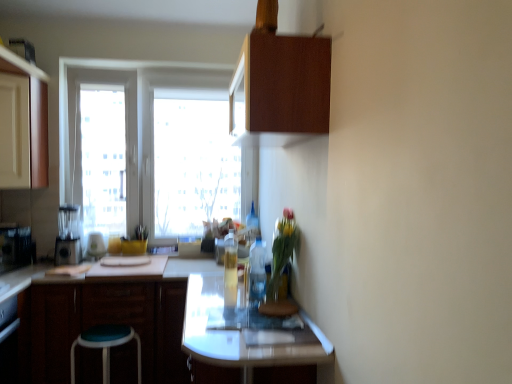
Where is `teal fabric stool at lower left`? teal fabric stool at lower left is located at coordinates (106, 346).

Where is `matte black blender at left, which is counted as the 2th appliance, starting from the right`? matte black blender at left, which is counted as the 2th appliance, starting from the right is located at coordinates (68, 236).

Image resolution: width=512 pixels, height=384 pixels. I want to click on translucent glass bottle at center, arranged as the 2th bottle when viewed from the front, so click(x=230, y=275).

What do you see at coordinates (281, 253) in the screenshot?
I see `translucent glass vase at center` at bounding box center [281, 253].

Where is `teal fabric stool at lower left`? This screenshot has height=384, width=512. teal fabric stool at lower left is located at coordinates (106, 346).

From the image's perspective, who appears lower, wooden cabinet at upper center, which is the third cabinetry from bottom to top, or teal fabric stool at lower left?

teal fabric stool at lower left.

Can we say wooden cabinet at upper center, placed as the first cabinetry when sorted from right to left, lies outside teal fabric stool at lower left?

Indeed, wooden cabinet at upper center, placed as the first cabinetry when sorted from right to left, is completely outside teal fabric stool at lower left.

From the picture: How many degrees apart are the facing directions of wooden cabinet at upper center, the third cabinetry in the left-to-right sequence, and teal fabric stool at lower left?

The facing directions of wooden cabinet at upper center, the third cabinetry in the left-to-right sequence, and teal fabric stool at lower left are 90 degrees apart.

Does point (316, 68) lie behind point (100, 344)?

No, it is in front of (100, 344).

Based on the photo, does translucent glass bottle at upper center, arranged as the 1th bottle when viewed from the back, touch teal fabric stool at lower left?

translucent glass bottle at upper center, arranged as the 1th bottle when viewed from the back, and teal fabric stool at lower left are not in contact.

Is point (249, 234) positioned after point (100, 333)?

Yes, point (249, 234) is farther from viewer.

Which object is further away from the camera, translucent glass bottle at upper center, acting as the third bottle starting from the front, or teal fabric stool at lower left?

translucent glass bottle at upper center, acting as the third bottle starting from the front, is further from the camera.

Considering the sizes of objects translucent glass bottle at upper center, acting as the third bottle starting from the front, and teal fabric stool at lower left in the image provided, who is thinner, translucent glass bottle at upper center, acting as the third bottle starting from the front, or teal fabric stool at lower left?

With smaller width is translucent glass bottle at upper center, acting as the third bottle starting from the front.

From a real-world perspective, does matte wood cabinet at left, positioned as the 3th cabinetry in right-to-left order, sit lower than metallic silver toaster at left, positioned as the 1th appliance in left-to-right order?

Actually, matte wood cabinet at left, positioned as the 3th cabinetry in right-to-left order, is physically above metallic silver toaster at left, positioned as the 1th appliance in left-to-right order, in the real world.

Considering the sizes of objects matte wood cabinet at left, the second cabinetry positioned from the bottom, and metallic silver toaster at left, positioned as the 1th appliance in left-to-right order, in the image provided, who is shorter, matte wood cabinet at left, the second cabinetry positioned from the bottom, or metallic silver toaster at left, positioned as the 1th appliance in left-to-right order,?

metallic silver toaster at left, positioned as the 1th appliance in left-to-right order, is shorter.

Considering the relative sizes of matte wood cabinet at left, positioned as the 3th cabinetry in right-to-left order, and metallic silver toaster at left, which appears as the 3th appliance when viewed from the right, in the image provided, is matte wood cabinet at left, positioned as the 3th cabinetry in right-to-left order, wider than metallic silver toaster at left, which appears as the 3th appliance when viewed from the right,?

Yes.

Measure the distance between matte wood cabinet at left, positioned as the 3th cabinetry in right-to-left order, and metallic silver toaster at left, which appears as the 3th appliance when viewed from the right.

They are 27.01 inches apart.

Considering the positions of points (22, 256) and (284, 111), is point (22, 256) farther from camera compared to point (284, 111)?

Yes, point (22, 256) is behind point (284, 111).

Find the location of `appliance that is the 2nd object directly below the wooden cabinet at upper center, the 1th cabinetry when ordered from top to bottom (from a real-world perspective)`. appliance that is the 2nd object directly below the wooden cabinet at upper center, the 1th cabinetry when ordered from top to bottom (from a real-world perspective) is located at coordinates (15, 248).

From the image's perspective, which one is positioned higher, metallic silver toaster at left, positioned as the 1th appliance in left-to-right order, or wooden cabinet at upper center, placed as the first cabinetry when sorted from right to left?

wooden cabinet at upper center, placed as the first cabinetry when sorted from right to left, appears higher in the image.

Can you tell me how much metallic silver toaster at left, positioned as the 1th appliance in left-to-right order, and wooden cabinet at upper center, placed as the first cabinetry when sorted from right to left, differ in facing direction?

There is a 163-degree angle between the facing directions of metallic silver toaster at left, positioned as the 1th appliance in left-to-right order, and wooden cabinet at upper center, placed as the first cabinetry when sorted from right to left.

Is translucent glass bottle at center, acting as the 2th bottle starting from the back, thinner than wooden cabinet at upper center, placed as the first cabinetry when sorted from right to left?

Indeed, translucent glass bottle at center, acting as the 2th bottle starting from the back, has a lesser width compared to wooden cabinet at upper center, placed as the first cabinetry when sorted from right to left.

What's the angular difference between translucent glass bottle at center, acting as the 2th bottle starting from the back, and wooden cabinet at upper center, the third cabinetry in the left-to-right sequence,'s facing directions?

4.03e-05 degrees separate the facing orientations of translucent glass bottle at center, acting as the 2th bottle starting from the back, and wooden cabinet at upper center, the third cabinetry in the left-to-right sequence.

Is translucent glass bottle at center, arranged as the 2th bottle when viewed from the front, next to wooden cabinet at upper center, which is the third cabinetry from bottom to top, and touching it?

No, translucent glass bottle at center, arranged as the 2th bottle when viewed from the front, is not next to wooden cabinet at upper center, which is the third cabinetry from bottom to top.

From the image's perspective, which one is positioned higher, translucent glass bottle at center, arranged as the 2th bottle when viewed from the front, or wooden cabinet at upper center, which is the third cabinetry from bottom to top?

wooden cabinet at upper center, which is the third cabinetry from bottom to top, appears higher in the image.

Is the position of translucent glass bottle at center, the 3th bottle positioned from the back, less distant than that of matte black blender at left, which is the second appliance from left to right?

Yes, it is in front of matte black blender at left, which is the second appliance from left to right.

How different are the orientations of translucent glass bottle at center, which is the first bottle in front-to-back order, and matte black blender at left, which is the second appliance from left to right, in degrees?

translucent glass bottle at center, which is the first bottle in front-to-back order, and matte black blender at left, which is the second appliance from left to right, are facing 90 degrees away from each other.

Is translucent glass bottle at center, the 3th bottle positioned from the back, shorter than matte black blender at left, which is counted as the 2th appliance, starting from the right?

Yes, translucent glass bottle at center, the 3th bottle positioned from the back, is shorter than matte black blender at left, which is counted as the 2th appliance, starting from the right.

In the scene shown: Between translucent glass bottle at center, the 3th bottle positioned from the back, and matte black blender at left, which is the second appliance from left to right, which one has smaller width?

Thinner between the two is translucent glass bottle at center, the 3th bottle positioned from the back.

Can you confirm if translucent glass vase at center is smaller than translucent glass bottle at center, arranged as the 2th bottle when viewed from the front?

No.

Is translucent glass vase at center located outside translucent glass bottle at center, arranged as the 2th bottle when viewed from the front?

Yes, translucent glass vase at center is outside of translucent glass bottle at center, arranged as the 2th bottle when viewed from the front.

Considering the positions of objects translucent glass vase at center and translucent glass bottle at center, acting as the 2th bottle starting from the back, in the image provided, who is more to the left, translucent glass vase at center or translucent glass bottle at center, acting as the 2th bottle starting from the back,?

Positioned to the left is translucent glass bottle at center, acting as the 2th bottle starting from the back.

From a real-world perspective, which cabinetry is the 3rd one above the teal fabric stool at lower left? Please provide its 2D coordinates.

[(280, 83)]

Find the location of a particular element. This screenshot has height=384, width=512. stool on the left of translucent glass bottle at upper center, arranged as the 1th bottle when viewed from the back is located at coordinates [106, 346].

From the image, which object appears to be farther from wooden cabinet at upper center, the third cabinetry in the left-to-right sequence, translucent glass bottle at center, the 3th bottle positioned from the back, or brushed metal blender at left, acting as the 3th appliance starting from the left?

The object further to wooden cabinet at upper center, the third cabinetry in the left-to-right sequence, is brushed metal blender at left, acting as the 3th appliance starting from the left.

Based on their spatial positions, is brushed metal blender at left, acting as the 3th appliance starting from the left, or wooden cabinet at upper center, which is the third cabinetry from bottom to top, further from metallic silver toaster at left, positioned as the 1th appliance in left-to-right order?

Based on the image, wooden cabinet at upper center, which is the third cabinetry from bottom to top, appears to be further to metallic silver toaster at left, positioned as the 1th appliance in left-to-right order.

Estimate the real-world distances between objects in this image. Which object is closer to dark brown wood cabinet at lower left, acting as the third cabinetry starting from the top, translucent glass bottle at center, acting as the 2th bottle starting from the back, or wooden cabinet at upper center, the 1th cabinetry when ordered from top to bottom?

translucent glass bottle at center, acting as the 2th bottle starting from the back.

Estimate the real-world distances between objects in this image. Which object is closer to metallic silver toaster at left, positioned as the 1th appliance in left-to-right order, translucent glass bottle at center, the 3th bottle positioned from the back, or brushed metal blender at left, the 1th appliance from the right?

brushed metal blender at left, the 1th appliance from the right, is closer to metallic silver toaster at left, positioned as the 1th appliance in left-to-right order.

Looking at the image, which one is located closer to dark brown wood cabinet at lower left, which is the 1th cabinetry from bottom to top, translucent glass vase at center or translucent glass bottle at center, which is the first bottle in front-to-back order?

translucent glass bottle at center, which is the first bottle in front-to-back order.

Which object lies nearer to the anchor point brushed metal blender at left, the 1th appliance from the right, translucent glass vase at center or translucent glass bottle at center, which is the first bottle in front-to-back order?

translucent glass bottle at center, which is the first bottle in front-to-back order, lies closer to brushed metal blender at left, the 1th appliance from the right, than the other object.

Estimate the real-world distances between objects in this image. Which object is further from translucent glass bottle at center, arranged as the 2th bottle when viewed from the front, teal fabric stool at lower left or translucent glass vase at center?

Among the two, teal fabric stool at lower left is located further to translucent glass bottle at center, arranged as the 2th bottle when viewed from the front.

Estimate the real-world distances between objects in this image. Which object is further from translucent glass bottle at upper center, arranged as the 1th bottle when viewed from the back, translucent glass vase at center or metallic silver toaster at left, which appears as the 3th appliance when viewed from the right?

Based on the image, metallic silver toaster at left, which appears as the 3th appliance when viewed from the right, appears to be further to translucent glass bottle at upper center, arranged as the 1th bottle when viewed from the back.

Image resolution: width=512 pixels, height=384 pixels. I want to click on plant between wooden cabinet at upper center, which is the third cabinetry from bottom to top, and brushed metal blender at left, the 1th appliance from the right, along the z-axis, so click(281, 253).

Identify the location of bottle situated between brushed metal blender at left, the 1th appliance from the right, and translucent glass bottle at upper center, arranged as the 1th bottle when viewed from the back, from left to right. The width and height of the screenshot is (512, 384). (230, 275).

Find the location of a particular element. Image resolution: width=512 pixels, height=384 pixels. cabinetry between matte wood cabinet at left, the second cabinetry in the top-to-bottom sequence, and translucent glass bottle at upper center, acting as the third bottle starting from the front is located at coordinates point(101,323).

At what (x,y) coordinates should I click in order to perform the action: click on stool located between brushed metal blender at left, the 1th appliance from the right, and translucent glass bottle at center, acting as the 2th bottle starting from the back, in the left-right direction. Please return your answer as a coordinate pair (x, y). The height and width of the screenshot is (384, 512). Looking at the image, I should click on (106, 346).